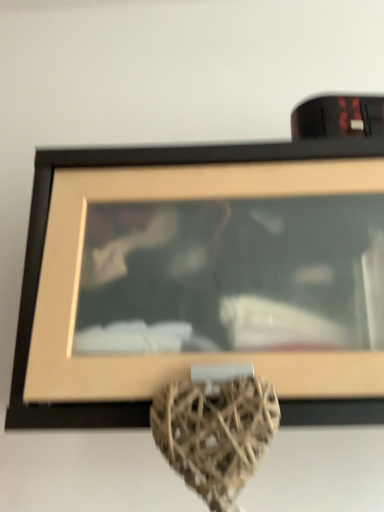
Question: In terms of width, does wooden frame at upper center look wider or thinner when compared to brown wicker heart at center?

Choices:
 (A) thin
 (B) wide

Answer: (B)

Question: Is wooden frame at upper center to the left or to the right of brown wicker heart at center in the image?

Choices:
 (A) right
 (B) left

Answer: (A)

Question: Is point (380, 304) positioned closer to the camera than point (226, 481)?

Choices:
 (A) closer
 (B) farther

Answer: (B)

Question: From a real-world perspective, relative to wooden frame at upper center, is brown wicker heart at center vertically above or below?

Choices:
 (A) below
 (B) above

Answer: (A)

Question: Based on their sizes in the image, would you say brown wicker heart at center is bigger or smaller than wooden frame at upper center?

Choices:
 (A) small
 (B) big

Answer: (A)

Question: Is brown wicker heart at center taller or shorter than wooden frame at upper center?

Choices:
 (A) short
 (B) tall

Answer: (B)

Question: From the image's perspective, is brown wicker heart at center located above or below wooden frame at upper center?

Choices:
 (A) above
 (B) below

Answer: (B)